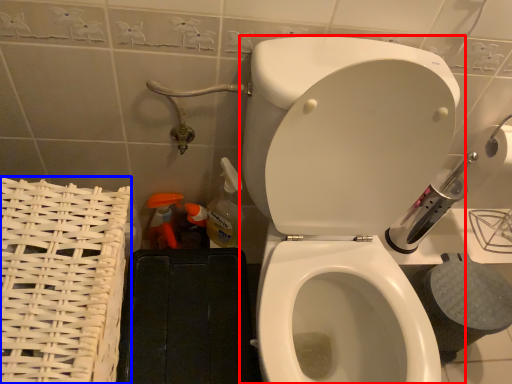
Question: Which point is closer to the camera, toilet (highlighted by a red box) or basket (highlighted by a blue box)?

Choices:
 (A) toilet
 (B) basket

Answer: (A)